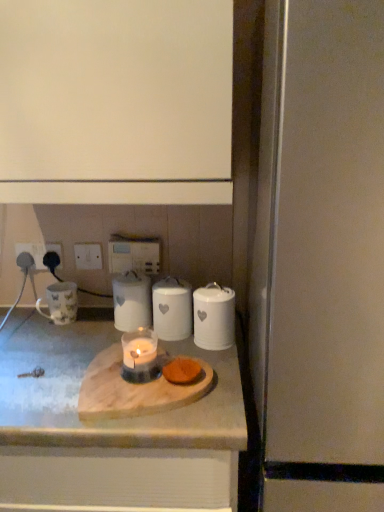
The height and width of the screenshot is (512, 384). Identify the location of free space in front of white glossy mug at left, which is counted as the first appliance, starting from the left. (46, 346).